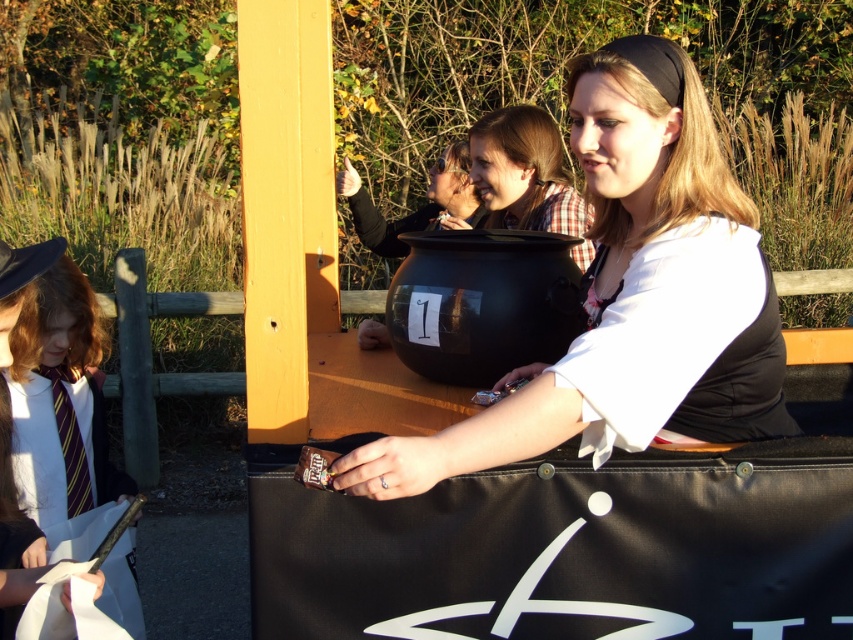
Is matte black cauldron at center behind white shirt with tie at left?

Yes, matte black cauldron at center is further from the viewer.

Is the position of matte black cauldron at center less distant than that of white shirt with tie at left?

No, it is not.

What do you see at coordinates (631, 296) in the screenshot? The height and width of the screenshot is (640, 853). I see `matte black cauldron at center` at bounding box center [631, 296].

Identify the location of matte black cauldron at center. (631, 296).